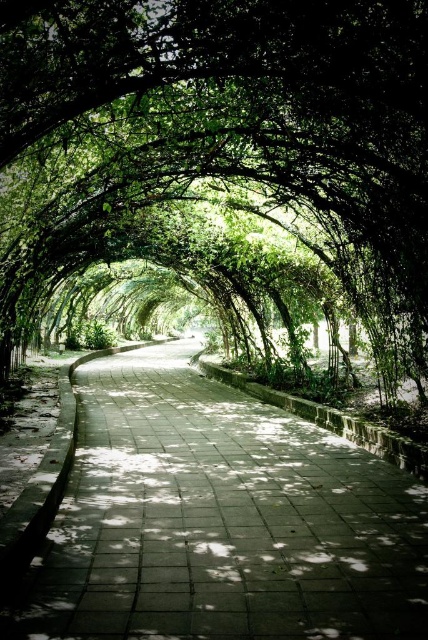
Question: Which of the following is the farthest from the observer?

Choices:
 (A) (15, 124)
 (B) (262, 625)

Answer: (A)

Question: Which of the following is the farthest from the observer?

Choices:
 (A) concrete paving at center
 (B) green leafy archway at center

Answer: (B)

Question: Can you confirm if green leafy archway at center is wider than concrete paving at center?

Choices:
 (A) yes
 (B) no

Answer: (B)

Question: Can you confirm if green leafy archway at center is wider than concrete paving at center?

Choices:
 (A) no
 (B) yes

Answer: (A)

Question: Is green leafy archway at center positioned behind concrete paving at center?

Choices:
 (A) no
 (B) yes

Answer: (B)